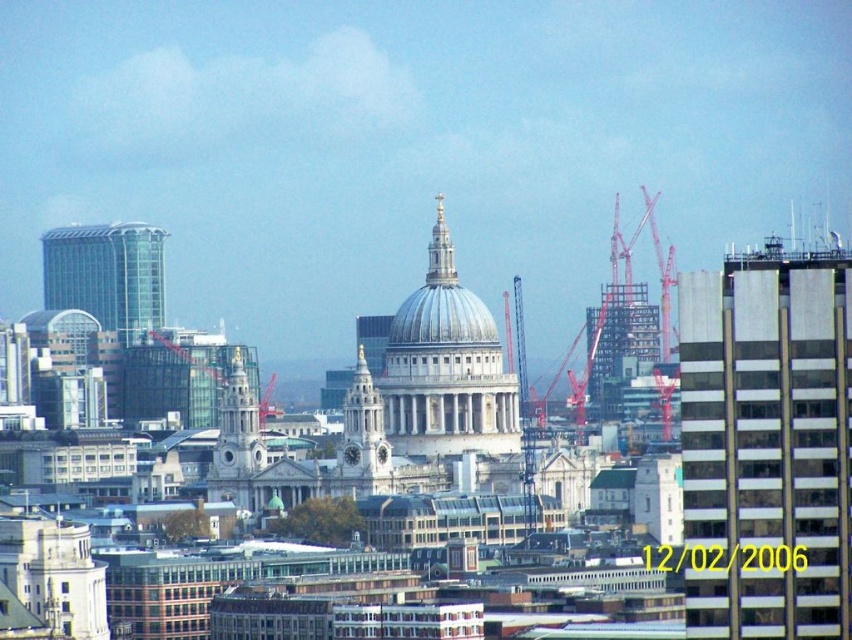
You are a city planner analyzing the urban layout. The transparent glass tower at left is part of a new development. What are its coordinates in the city grid system?

The transparent glass tower at left is located at coordinates point (107, 275).

You are a drone operator trying to capture a photo of the shiny silver dome at center. Your drone is currently hovering near the transparent glass tower at left. Can you fly the drone forward to get a clear shot of the dome without any obstruction?

The shiny silver dome at center is behind the transparent glass tower at left, so flying the drone forward from the tower would still leave the tower between the drone and the dome, obstructing the view. To get an unobstructed shot, you should position the drone to the side or above the transparent glass tower at left.